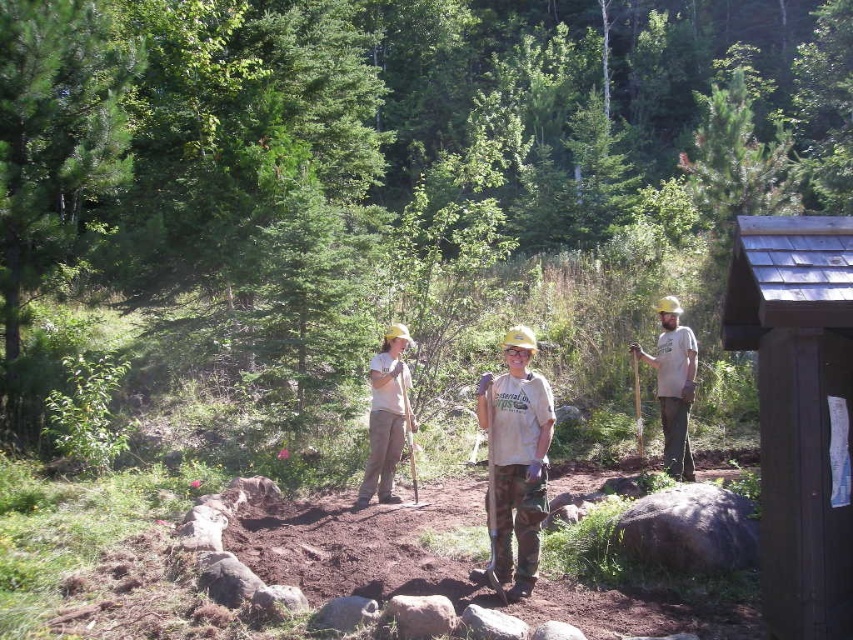
What do you see at coordinates (515, 461) in the screenshot?
I see `camouflage pants at center` at bounding box center [515, 461].

Which of these two, camouflage pants at center or light brown wood shovel at center, stands taller?

light brown wood shovel at center is taller.

Which is in front, point (514, 481) or point (693, 348)?

Point (514, 481) is in front.

The height and width of the screenshot is (640, 853). Identify the location of camouflage pants at center. (515, 461).

Between wooden shingled hut at right and camouflage pants at center, which one is positioned higher?

Positioned higher is wooden shingled hut at right.

Is point (792, 573) positioned in front of point (526, 433)?

Yes, point (792, 573) is closer to viewer.

Identify the location of wooden shingled hut at right. The image size is (853, 640). (798, 412).

Is point (614, 339) more distant than point (692, 394)?

That is True.

Identify the location of green leafy forest at center. (381, 188).